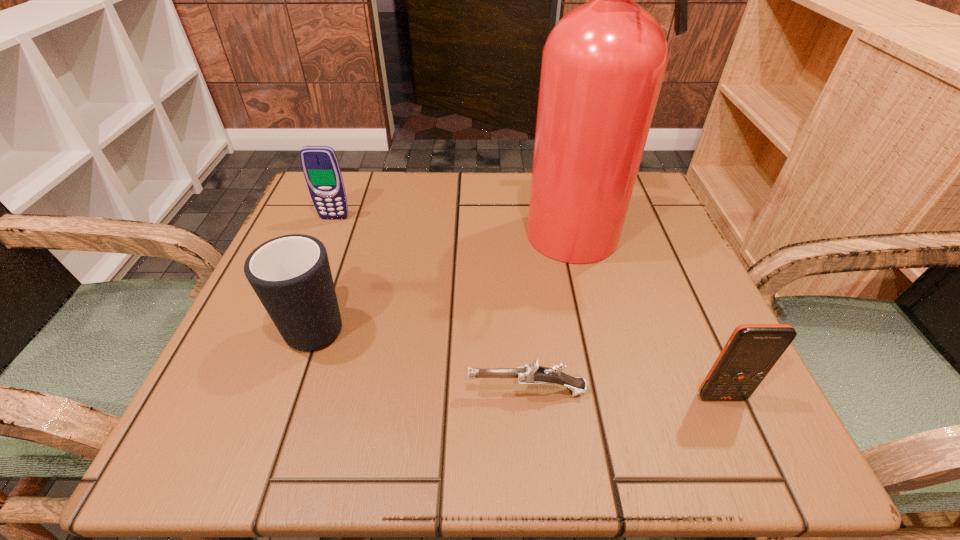
Find the location of a particular element. free location located on the screen of the nearer cellular telephone is located at coordinates (742, 444).

The height and width of the screenshot is (540, 960). Find the location of `vacant area located aimed along the barrel of the shortest object`. vacant area located aimed along the barrel of the shortest object is located at coordinates (223, 392).

This screenshot has width=960, height=540. What are the coordinates of `free space located aimed along the barrel of the shortest object` in the screenshot? It's located at (364, 392).

The height and width of the screenshot is (540, 960). Identify the location of vacant space located aimed along the barrel of the shortest object. (258, 392).

Identify the location of fire extinguisher situated at the far edge. Image resolution: width=960 pixels, height=540 pixels. (603, 64).

The width and height of the screenshot is (960, 540). Find the location of `cellular telephone located in the far edge section of the desktop`. cellular telephone located in the far edge section of the desktop is located at coordinates (320, 165).

At what (x,y) coordinates should I click in order to perform the action: click on cellular telephone at the near edge. Please return your answer as a coordinate pair (x, y). This screenshot has width=960, height=540. Looking at the image, I should click on (752, 350).

Locate an element on the screen. gun at the near edge is located at coordinates (531, 374).

At what (x,y) coordinates should I click in order to perform the action: click on cellular telephone located in the left edge section of the desktop. Please return your answer as a coordinate pair (x, y). Looking at the image, I should click on (320, 165).

Locate an element on the screen. The height and width of the screenshot is (540, 960). mug that is at the left edge is located at coordinates (290, 274).